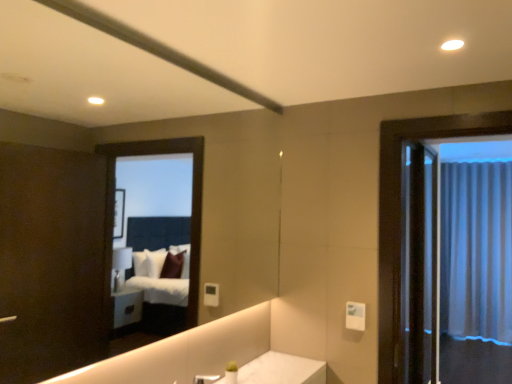
Question: Is point (462, 183) positioned closer to the camera than point (210, 380)?

Choices:
 (A) closer
 (B) farther

Answer: (B)

Question: Is white sheer curtain at right inside or outside of silver metallic faucet at lower center?

Choices:
 (A) inside
 (B) outside

Answer: (B)

Question: Which object is positioned closest to the clear glass screen door at right?

Choices:
 (A) silver metallic faucet at lower center
 (B) white sheer curtain at right

Answer: (B)

Question: Which object is positioned farthest from the clear glass screen door at right?

Choices:
 (A) silver metallic faucet at lower center
 (B) white sheer curtain at right

Answer: (A)